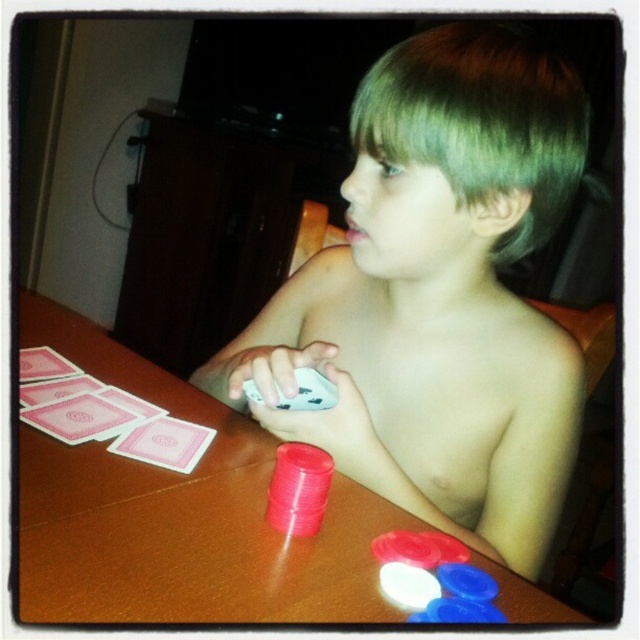
What is the 2D coordinate of the brown wooden table at center?

The brown wooden table at center is located at the 2D coordinate point of (x=177, y=515).

You are standing 20 inches away from the camera. You want to place a 4 inch tall trophy on the brown wooden table at center. Can you reach the table to place the trophy?

The distance between the brown wooden table at center and the camera is 16.74 inches. Since you are 20 inches away from the camera, you are 3.26 inches away from the table, so yes, you can reach the table to place the trophy.

You are trying to place a small sticker between the shiny plastic cards at center and the green matte hair at upper center. Based on their sizes, do you think there will be enough space for the sticker?

The shiny plastic cards at center might be wider than green matte hair at upper center, so there might not be enough space for the sticker between them.